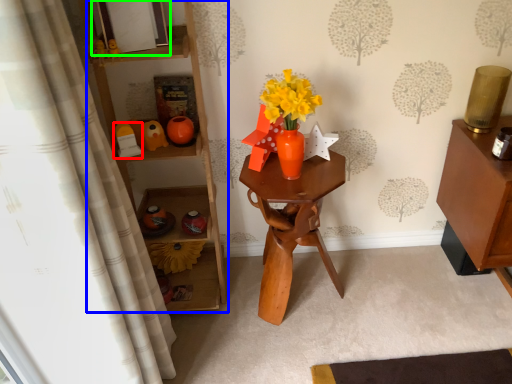
Question: Estimate the real-world distances between objects in this image. Which object is farther from toy (highlighted by a red box), shelf (highlighted by a blue box) or picture frame (highlighted by a green box)?

Choices:
 (A) shelf
 (B) picture frame

Answer: (B)